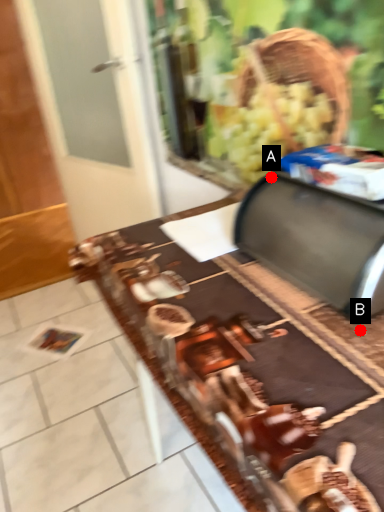
Question: Two points are circled on the image, labeled by A and B beside each circle. Which point is closer to the camera?

Choices:
 (A) A is closer
 (B) B is closer

Answer: (B)